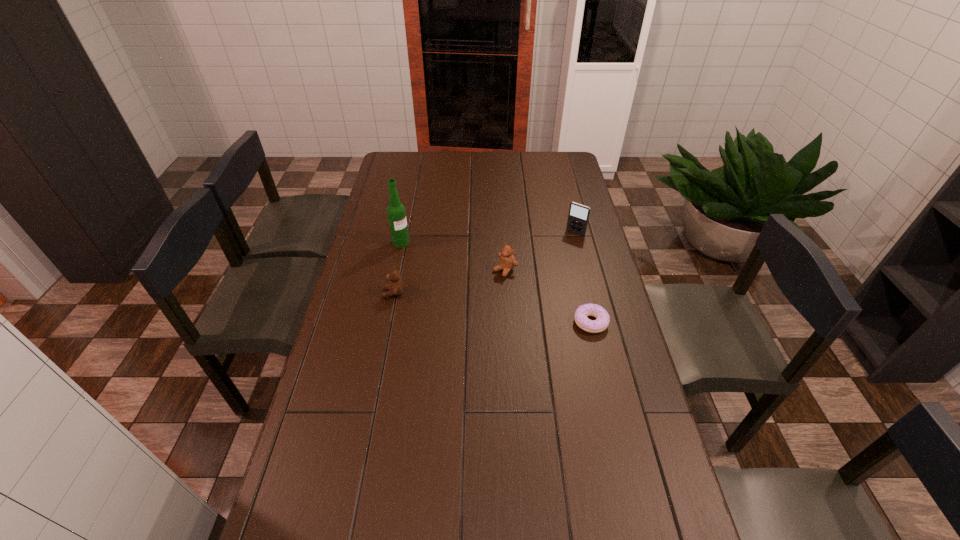
Where is `free space located 0.080m at the face of the fourth farthest object`? free space located 0.080m at the face of the fourth farthest object is located at coordinates (360, 293).

At what (x,y) coordinates should I click in order to perform the action: click on free space located on the back of the nearest object. Please return your answer as a coordinate pair (x, y). This screenshot has height=540, width=960. Looking at the image, I should click on (577, 262).

Identify the location of free location located on the front-facing side of the farthest object. (550, 264).

You are a GUI agent. You are given a task and a screenshot of the screen. Output one action in this format:
    pyautogui.click(x=<x>, y=<y>)
    Task: Click on the free space located 0.330m on the front-facing side of the farthest object
    Image resolution: width=960 pixels, height=540 pixels.
    Given the screenshot: What is the action you would take?
    pyautogui.click(x=535, y=285)

Where is `blank space located on the front-facing side of the farthest object`? Image resolution: width=960 pixels, height=540 pixels. blank space located on the front-facing side of the farthest object is located at coordinates (550, 264).

This screenshot has height=540, width=960. I want to click on blank area located 0.070m on the face of the third object from right to left, so click(x=485, y=286).

Where is `vacant region located on the face of the third object from right to left`? Image resolution: width=960 pixels, height=540 pixels. vacant region located on the face of the third object from right to left is located at coordinates (489, 284).

This screenshot has width=960, height=540. I want to click on free space located 0.320m on the face of the third object from right to left, so click(x=434, y=327).

Where is `free spot located on the label of the second farthest object`? Image resolution: width=960 pixels, height=540 pixels. free spot located on the label of the second farthest object is located at coordinates (446, 274).

What are the coordinates of `vacant space positioned on the label of the second farthest object` in the screenshot? It's located at (454, 280).